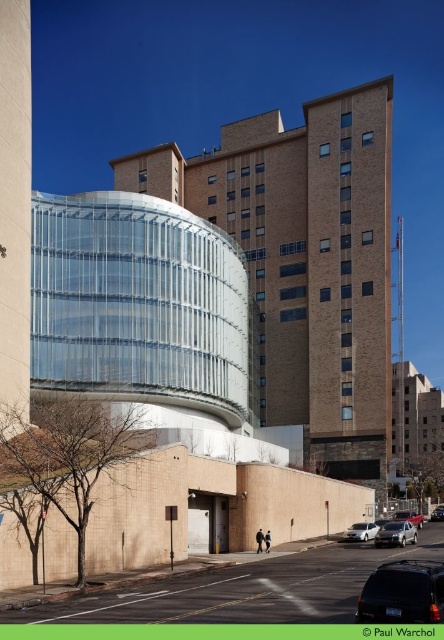
Does matte black suv at lower right have a smaller size compared to metallic silver sedan at center?

No.

Who is shorter, matte black suv at lower right or metallic silver sedan at center?

With less height is metallic silver sedan at center.

Between point (428, 604) and point (432, 518), which one is positioned in front?

Point (428, 604) is more forward.

At what (x,y) coordinates should I click in order to perform the action: click on matte black suv at lower right. Please return your answer as a coordinate pair (x, y). Looking at the image, I should click on (403, 593).

From the picture: Is white matte car at lower center taller than silver metallic sedan at center?

In fact, white matte car at lower center may be shorter than silver metallic sedan at center.

This screenshot has width=444, height=640. What are the coordinates of `white matte car at lower center` in the screenshot? It's located at (361, 531).

What are the coordinates of `white matte car at lower center` in the screenshot? It's located at (x=361, y=531).

Based on the photo, who is higher up, silver metallic sedan at center or metallic silver sedan at center?

Positioned higher is silver metallic sedan at center.

Who is taller, silver metallic sedan at center or metallic silver sedan at center?

silver metallic sedan at center is taller.

Where is `silver metallic sedan at center`? silver metallic sedan at center is located at coordinates (409, 516).

In order to click on silver metallic sedan at center in this screenshot , I will do `click(409, 516)`.